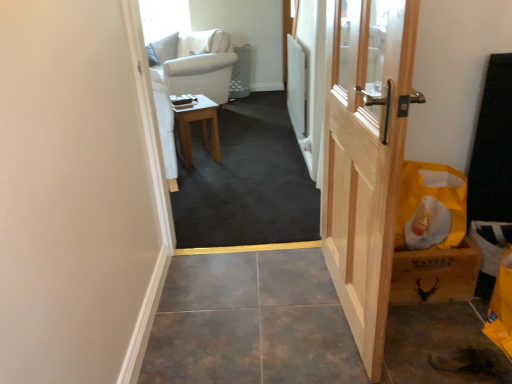
Find the location of a particular element. The image size is (512, 384). vacant area to the right of wooden table at center is located at coordinates (241, 151).